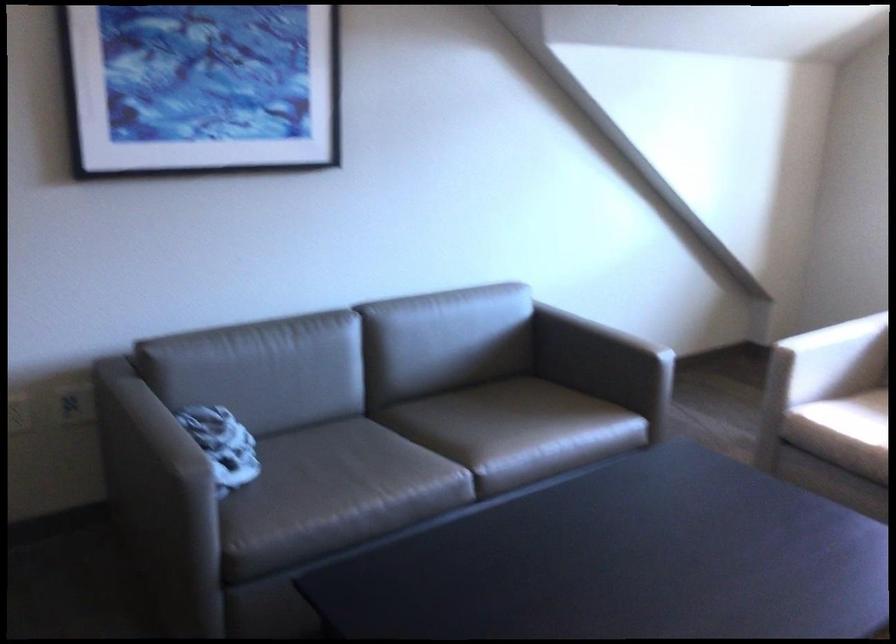
Locate an element on the screen. The height and width of the screenshot is (644, 896). sofa armrest is located at coordinates (158, 491).